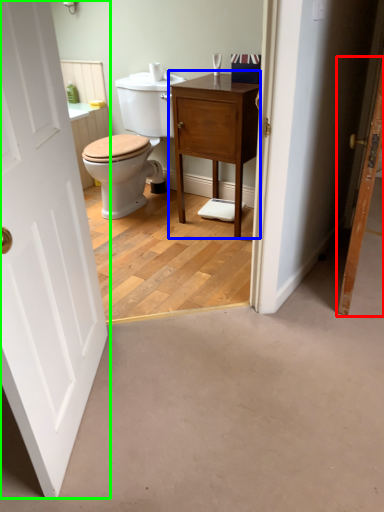
Question: Which object is positioned farthest from door (highlighted by a red box)? Select from nightstand (highlighted by a blue box) and door (highlighted by a green box).

Choices:
 (A) nightstand
 (B) door

Answer: (B)